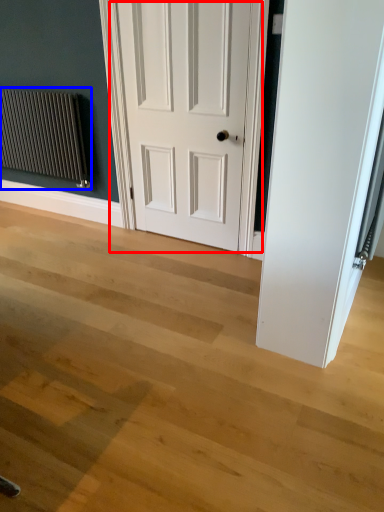
Question: Which of the following is the closest to the observer, door (highlighted by a red box) or radiator (highlighted by a blue box)?

Choices:
 (A) door
 (B) radiator

Answer: (A)